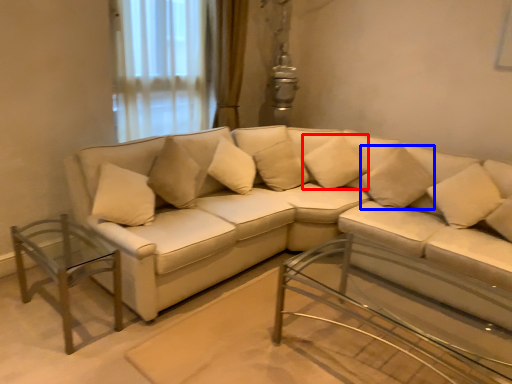
Question: Which of the following is the closest to the observer, pillow (highlighted by a red box) or pillow (highlighted by a blue box)?

Choices:
 (A) pillow
 (B) pillow

Answer: (B)